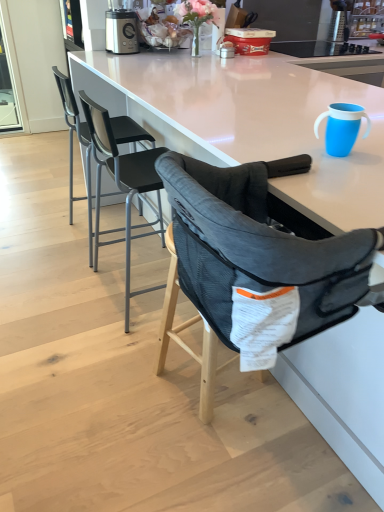
Where is `vacant space in front of blue plastic cup at upper right`? The image size is (384, 512). vacant space in front of blue plastic cup at upper right is located at coordinates (337, 173).